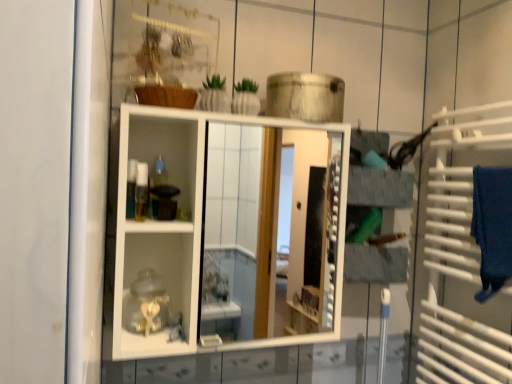
Based on the photo, measure the distance between point (x=143, y=185) and camera.

The distance of point (x=143, y=185) from camera is 1.11 meters.

I want to click on white glossy cabinet at center, so click(226, 233).

Is white glossy cabinet at center located within translucent plastic container at center?

Actually, white glossy cabinet at center is outside translucent plastic container at center.

Which point is more forward, (x=142, y=199) or (x=205, y=114)?

The point (x=205, y=114) is more forward.

Is translucent plastic container at center looking in the opposite direction of white glossy cabinet at center?

Yes, translucent plastic container at center is facing away from white glossy cabinet at center.

In terms of height, does translucent plastic container at center look taller or shorter compared to white glossy cabinet at center?

In the image, translucent plastic container at center appears to be shorter than white glossy cabinet at center.

Which of these two, blue fabric bath towel at right or white metal towel rack at right, is bigger?

white metal towel rack at right is bigger.

Consider the image. Which is correct: blue fabric bath towel at right is inside white metal towel rack at right, or outside of it?

blue fabric bath towel at right is inside white metal towel rack at right.

Is blue fabric bath towel at right positioned in front of white metal towel rack at right?

Yes, blue fabric bath towel at right is closer to the camera.

Could you tell me if blue fabric bath towel at right is turned towards white metal towel rack at right?

Yes, blue fabric bath towel at right is oriented towards white metal towel rack at right.

Locate an element on the screen. The image size is (512, 384). shelf positioned vertically above the white metal towel rack at right (from a real-world perspective) is located at coordinates (226, 233).

Can white glossy cabinet at center be found inside white metal towel rack at right?

That's incorrect, white glossy cabinet at center is not inside white metal towel rack at right.

From a real-world perspective, between white metal towel rack at right and white glossy cabinet at center, who is vertically higher?

From a 3D spatial view, white glossy cabinet at center is above.

Which of these two, white metal towel rack at right or white glossy cabinet at center, is smaller?

With smaller size is white metal towel rack at right.

From the picture: Does white glossy cabinet at center have a greater height compared to white metal towel rack at right?

No.

Which object is positioned more to the right, white glossy cabinet at center or white metal towel rack at right?

white metal towel rack at right is more to the right.

Between white glossy cabinet at center and white metal towel rack at right, which one has smaller width?

white metal towel rack at right.

Is white glossy cabinet at center located outside white metal towel rack at right?

Yes, white glossy cabinet at center is not within white metal towel rack at right.

From a real-world perspective, is white glossy cabinet at center located beneath blue fabric bath towel at right?

Yes, from a real-world perspective, white glossy cabinet at center is under blue fabric bath towel at right.

Does white glossy cabinet at center appear on the right side of blue fabric bath towel at right?

Incorrect, white glossy cabinet at center is not on the right side of blue fabric bath towel at right.

Is white glossy cabinet at center beside blue fabric bath towel at right?

No, white glossy cabinet at center is not touching blue fabric bath towel at right.

Between white glossy cabinet at center and blue fabric bath towel at right, which one has smaller size?

blue fabric bath towel at right.

Which is behind, point (476, 234) or point (272, 252)?

Positioned behind is point (272, 252).

From the image's perspective, is blue fabric bath towel at right below white glossy cabinet at center?

Yes.

Looking at the image, does blue fabric bath towel at right seem bigger or smaller compared to white glossy cabinet at center?

Considering their sizes, blue fabric bath towel at right takes up less space than white glossy cabinet at center.

Is blue fabric bath towel at right facing away from white glossy cabinet at center?

No, blue fabric bath towel at right's orientation is not away from white glossy cabinet at center.

Is translucent plastic container at center far from blue fabric bath towel at right?

translucent plastic container at center is actually quite close to blue fabric bath towel at right.

Is translucent plastic container at center aimed at blue fabric bath towel at right?

No, translucent plastic container at center is not aimed at blue fabric bath towel at right.

Which object is further away from the camera, translucent plastic container at center or blue fabric bath towel at right?

translucent plastic container at center.

The width and height of the screenshot is (512, 384). Identify the location of shelf below the translucent plastic container at center (from a real-world perspective). (226, 233).

Locate an element on the screen. bath towel above the white metal towel rack at right (from the image's perspective) is located at coordinates (492, 227).

Based on their spatial positions, is white glossy cabinet at center or blue fabric bath towel at right further from translucent plastic container at center?

white glossy cabinet at center lies further to translucent plastic container at center than the other object.

Considering their positions, is white glossy cabinet at center positioned further to translucent plastic container at center than white metal towel rack at right?

The object further to translucent plastic container at center is white glossy cabinet at center.

In the scene shown: From the image, which object appears to be nearer to translucent plastic container at center, white metal towel rack at right or blue fabric bath towel at right?

blue fabric bath towel at right is positioned closer to the anchor translucent plastic container at center.

Considering their positions, is translucent plastic container at center positioned closer to white metal towel rack at right than blue fabric bath towel at right?

blue fabric bath towel at right is closer to white metal towel rack at right.

Estimate the real-world distances between objects in this image. Which object is further from white metal towel rack at right, white glossy cabinet at center or translucent plastic container at center?

Among the two, white glossy cabinet at center is located further to white metal towel rack at right.

Considering their positions, is translucent plastic container at center positioned closer to white metal towel rack at right than white glossy cabinet at center?

translucent plastic container at center is positioned closer to the anchor white metal towel rack at right.

Based on their spatial positions, is white metal towel rack at right or translucent plastic container at center closer to white glossy cabinet at center?

white metal towel rack at right is closer to white glossy cabinet at center.

Based on their spatial positions, is translucent plastic container at center or white metal towel rack at right closer to white glossy cabinet at center?

white metal towel rack at right is closer to white glossy cabinet at center.

Image resolution: width=512 pixels, height=384 pixels. I want to click on cage between translucent plastic container at center and blue fabric bath towel at right from left to right, so click(460, 253).

The width and height of the screenshot is (512, 384). In order to click on cage located between white glossy cabinet at center and blue fabric bath towel at right in the left-right direction in this screenshot , I will do `click(460, 253)`.

Image resolution: width=512 pixels, height=384 pixels. Find the location of `shelf between translucent plastic container at center and white metal towel rack at right from left to right`. shelf between translucent plastic container at center and white metal towel rack at right from left to right is located at coordinates (226, 233).

In order to click on shelf between translucent plastic container at center and blue fabric bath towel at right from left to right in this screenshot , I will do `click(226, 233)`.